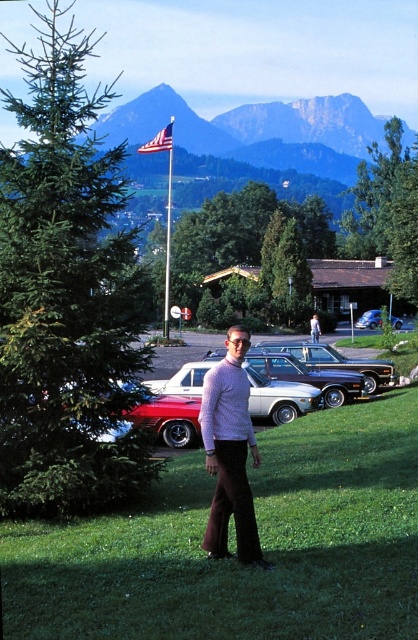
Is green leafy tree at left positioned behind shiny metallic sedan at center?

No, green leafy tree at left is closer to the viewer.

Can you confirm if green leafy tree at left is positioned below shiny metallic sedan at center?

No, green leafy tree at left is not below shiny metallic sedan at center.

Measure the distance between green leafy tree at left and camera.

9.36 meters

This screenshot has width=418, height=640. Identify the location of green leafy tree at left. (66, 296).

How much distance is there between green grass at center and shiny metallic sedan at center?

green grass at center is 11.24 meters from shiny metallic sedan at center.

Is green grass at center taller than shiny metallic sedan at center?

In fact, green grass at center may be shorter than shiny metallic sedan at center.

Describe the element at coordinates (234, 557) in the screenshot. I see `green grass at center` at that location.

The height and width of the screenshot is (640, 418). I want to click on green grass at center, so click(234, 557).

Is plaid shirt at center bigger than metallic blue car at center?

Incorrect, plaid shirt at center is not larger than metallic blue car at center.

Which is above, plaid shirt at center or metallic blue car at center?

metallic blue car at center is above.

The height and width of the screenshot is (640, 418). What are the coordinates of `plaid shirt at center` in the screenshot? It's located at (229, 452).